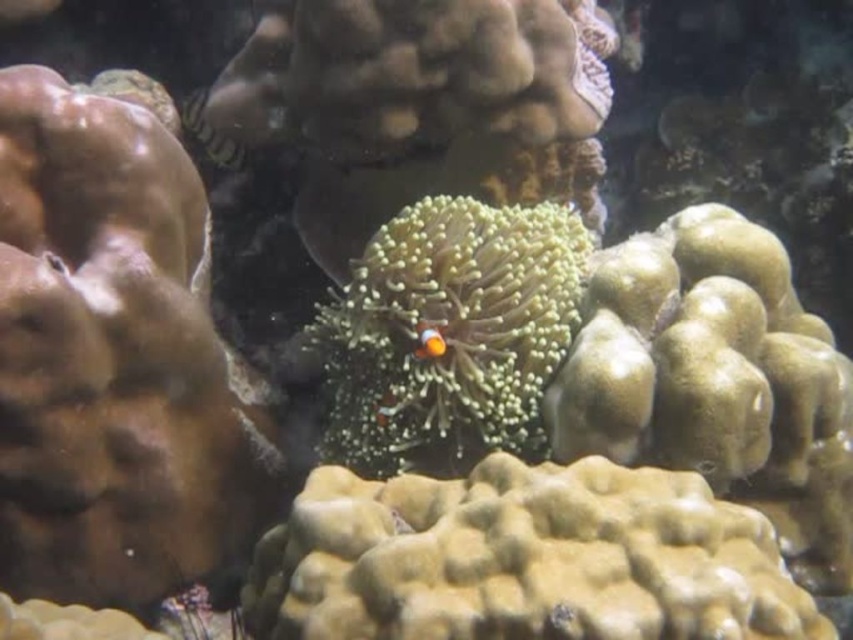
Question: Which of these objects is positioned closest to the bright orange clownfish at center?

Choices:
 (A) green fuzzy coral at center
 (B) shiny green fish at upper left

Answer: (A)

Question: Which of the following is the closest to the observer?

Choices:
 (A) shiny green fish at upper left
 (B) bright orange clownfish at center

Answer: (B)

Question: Can you confirm if green fuzzy coral at center is bigger than bright orange clownfish at center?

Choices:
 (A) yes
 (B) no

Answer: (A)

Question: Which object is positioned farthest from the shiny green fish at upper left?

Choices:
 (A) bright orange clownfish at center
 (B) green fuzzy coral at center

Answer: (A)

Question: Does shiny green fish at upper left appear on the right side of bright orange clownfish at center?

Choices:
 (A) yes
 (B) no

Answer: (B)

Question: Is green fuzzy coral at center thinner than bright orange clownfish at center?

Choices:
 (A) no
 (B) yes

Answer: (A)